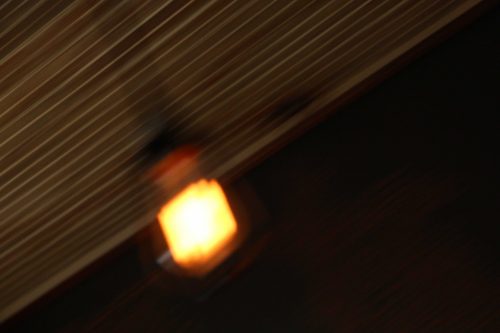
This screenshot has height=333, width=500. Find the location of `metal base of light`. metal base of light is located at coordinates (167, 257).